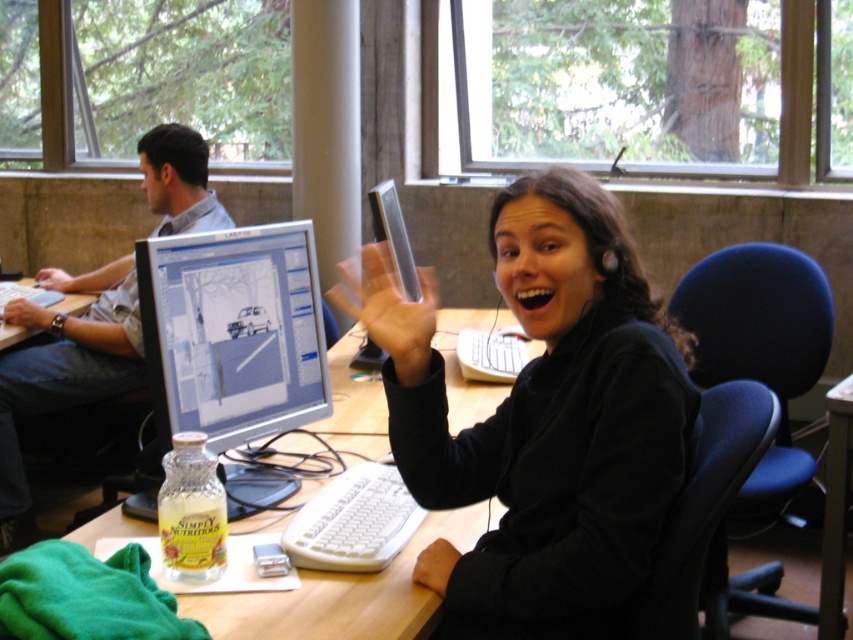
Is black matte headphones at upper center further to the viewer compared to wooden desk at center?

That is False.

Between black matte headphones at upper center and wooden desk at center, which one has more height?

black matte headphones at upper center

The width and height of the screenshot is (853, 640). Identify the location of black matte headphones at upper center. (544, 420).

Does wooden desk at center have a lesser width compared to matte gray shirt at left?

No, wooden desk at center is not thinner than matte gray shirt at left.

Is wooden desk at center smaller than matte gray shirt at left?

Incorrect, wooden desk at center is not smaller in size than matte gray shirt at left.

Between point (178, 608) and point (26, 528), which one is positioned in front?

Positioned in front is point (178, 608).

Locate an element on the screen. The width and height of the screenshot is (853, 640). wooden desk at center is located at coordinates (341, 595).

Can you confirm if black matte headphones at upper center is smaller than matte gray shirt at left?

Yes, black matte headphones at upper center is smaller than matte gray shirt at left.

Can you confirm if black matte headphones at upper center is taller than matte gray shirt at left?

In fact, black matte headphones at upper center may be shorter than matte gray shirt at left.

At what (x,y) coordinates should I click in order to perform the action: click on black matte headphones at upper center. Please return your answer as a coordinate pair (x, y). The image size is (853, 640). Looking at the image, I should click on (544, 420).

At what (x,y) coordinates should I click in order to perform the action: click on black matte headphones at upper center. Please return your answer as a coordinate pair (x, y). This screenshot has width=853, height=640. Looking at the image, I should click on (544, 420).